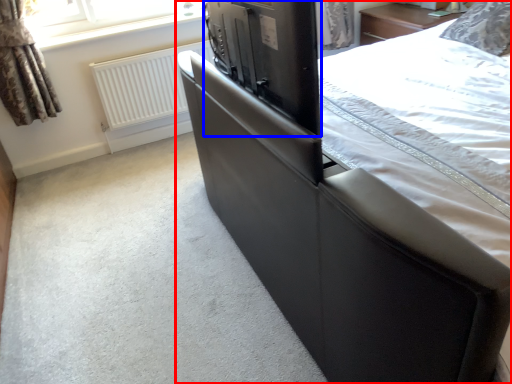
Question: Among these objects, which one is nearest to the camera, bed (highlighted by a red box) or appliance (highlighted by a blue box)?

Choices:
 (A) bed
 (B) appliance

Answer: (A)